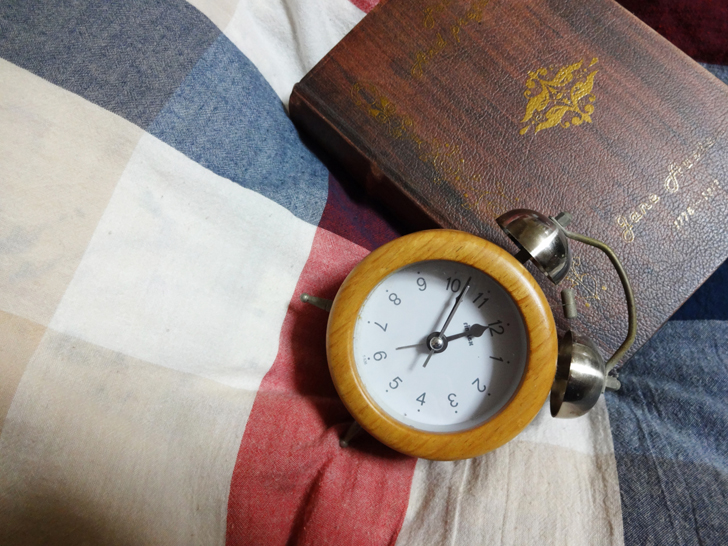
Locate an element on the screen. clock is located at coordinates (400, 318).